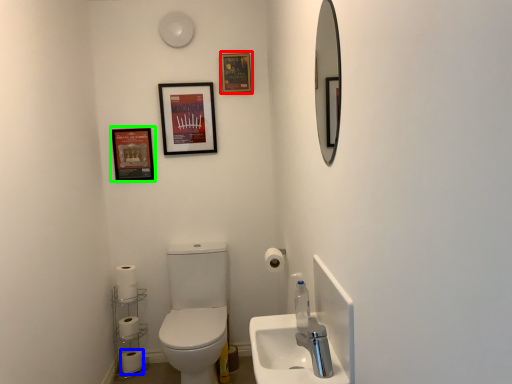
Question: Which object is positioned farthest from decorative picture (highlighted by a red box)? Select from toilet paper (highlighted by a blue box) and decorative picture (highlighted by a green box).

Choices:
 (A) toilet paper
 (B) decorative picture

Answer: (A)